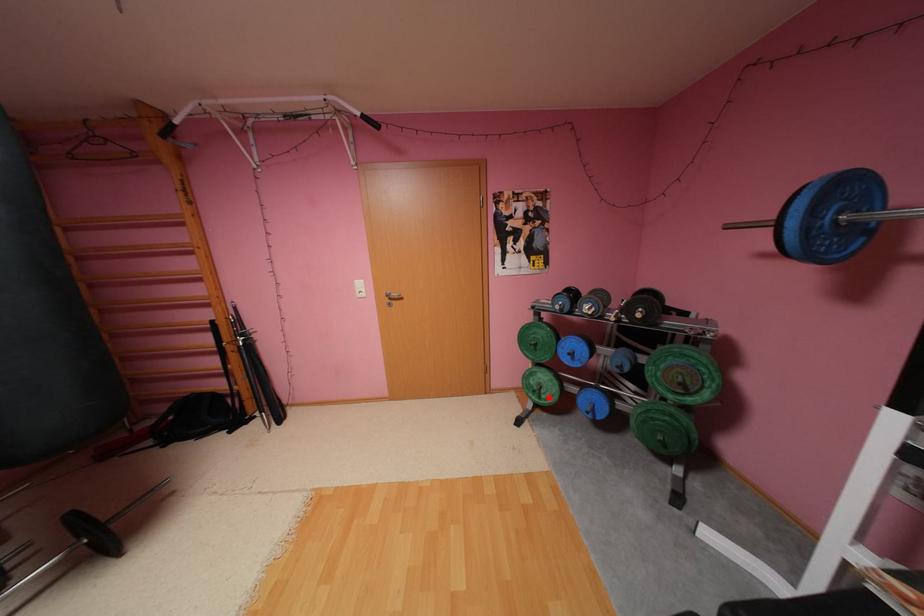
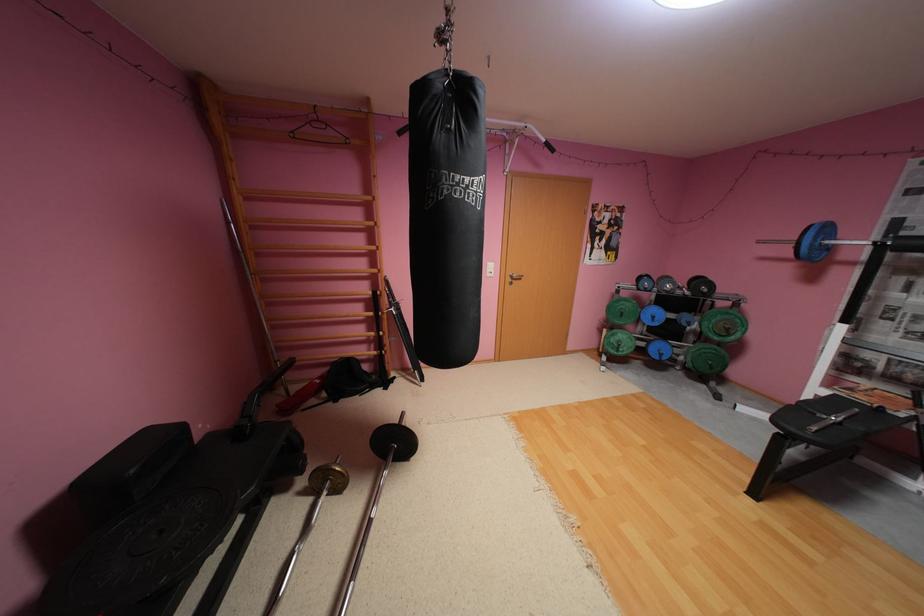
Question: I am providing you with two images of the same scene from different viewpoints. A red point is shown in image1. For the corresponding object point in image2, is it positioned nearer or farther from the camera?

Choices:
 (A) Nearer
 (B) Farther

Answer: (A)